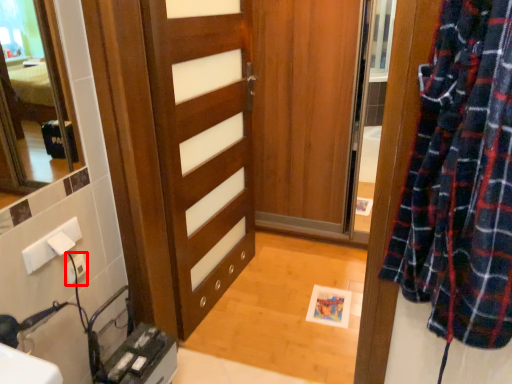
Question: From the image, what is the correct spatial relationship of electric outlet (annotated by the red box) in relation to door?

Choices:
 (A) left
 (B) right

Answer: (A)